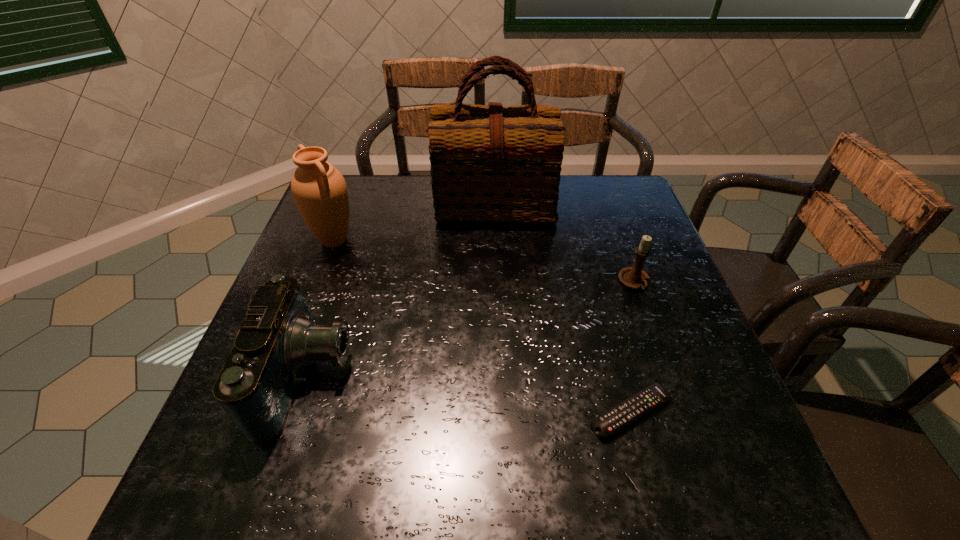
You are a GUI agent. You are given a task and a screenshot of the screen. Output one action in this format:
    pyautogui.click(x=<x>, y=<y>)
    Task: Click on the vacant area that lies between the fourth tallest object and the camcorder
    The width and height of the screenshot is (960, 540).
    Given the screenshot: What is the action you would take?
    pyautogui.click(x=471, y=330)

Select which object appears as the fourth closest to the tallest object. Please provide its 2D coordinates. Your answer should be formatted as a tuple, i.e. [(x, y)], where the tuple contains the x and y coordinates of a point satisfying the conditions above.

[(608, 423)]

Locate an element on the screen. object that can be found as the fourth closest to the shortest object is located at coordinates (319, 190).

Locate an element on the screen. blank area in the image that satisfies the following two spatial constraints: 1. on the side of the second shortest object with the handle; 2. on the front-facing side of the camcorder is located at coordinates click(668, 377).

Find the location of a particular element. vacant region that satisfies the following two spatial constraints: 1. on the side of the third farthest object with the handle; 2. on the front-facing side of the third shortest object is located at coordinates (668, 377).

Find the location of a particular element. The width and height of the screenshot is (960, 540). vacant area in the image that satisfies the following two spatial constraints: 1. on the front-facing side of the remote control; 2. on the right side of the third shortest object is located at coordinates (298, 413).